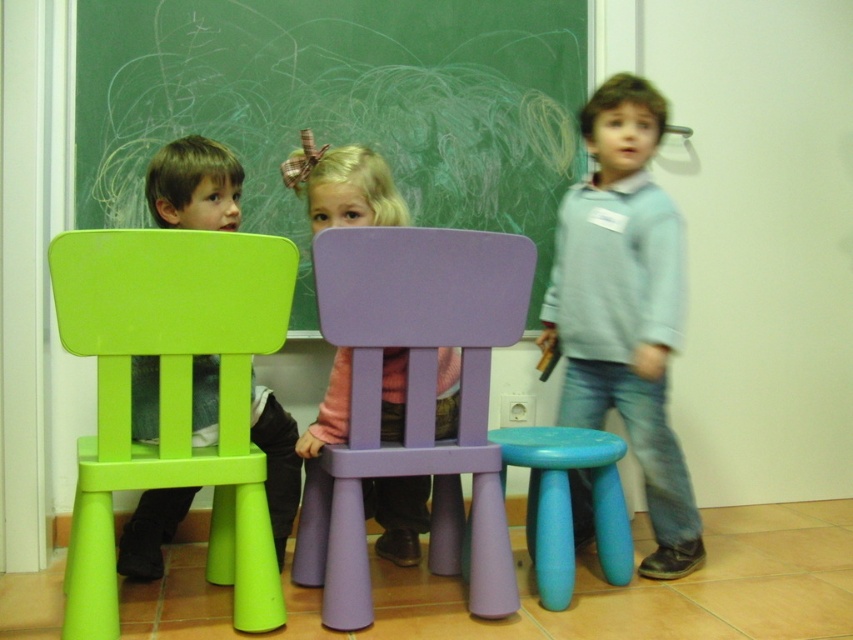
You are a teacher standing at the front of the classroom. You want to hand out a book to the student sitting on the purple plastic chair at center. The book is on a shelf 1.5 meters away from you. Can you reach the student without moving from your current position?

The purple plastic chair at center is 1.74 meters away from the viewer. Since the book is only 1.5 meters away from you, you cannot reach the student sitting on the purple plastic chair at center because the distance between you and the chair is greater than the bookshelf distance.

You are a teacher in a classroom and want to adjust the seating arrangement so that the green plastic chair at left is at the same height as the matte blue stool at lower center. Which object should you lower or raise?

The green plastic chair at left is much taller than the matte blue stool at lower center. To make them the same height, you should lower the green plastic chair at left.

You are a teacher in the classroom. You need to hang a poster between the green chalkboard at upper center and the pink fabric dress at center. Where should you place it so it is centered between them?

The poster should be placed between the green chalkboard at upper center and the pink fabric dress at center, aligned to the left side of the pink fabric dress at center since the green chalkboard at upper center is to the left of the pink fabric dress at center.